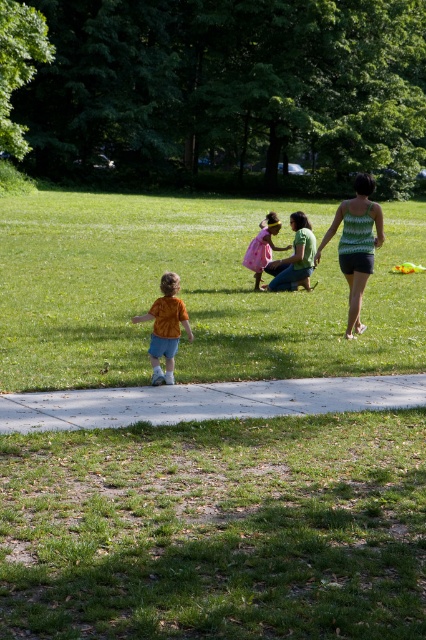
Question: Which point is farther to the camera?

Choices:
 (A) tap(348, 253)
 (B) tap(186, 317)
 (C) tap(65, 356)

Answer: (A)

Question: In this image, where is green grass at center located relative to pink satin dress at center?

Choices:
 (A) right
 (B) left

Answer: (B)

Question: Among these points, which one is farthest from the camera?

Choices:
 (A) (276, 216)
 (B) (371, 244)
 (C) (69, 275)
 (D) (253, 396)

Answer: (C)

Question: Is green textured tank top at center smaller than pink satin dress at center?

Choices:
 (A) yes
 (B) no

Answer: (B)

Question: Does green grass at center appear over green textured tank top at center?

Choices:
 (A) no
 (B) yes

Answer: (A)

Question: Which of the following is the closest to the observer?

Choices:
 (A) (362, 388)
 (B) (267, 244)

Answer: (A)